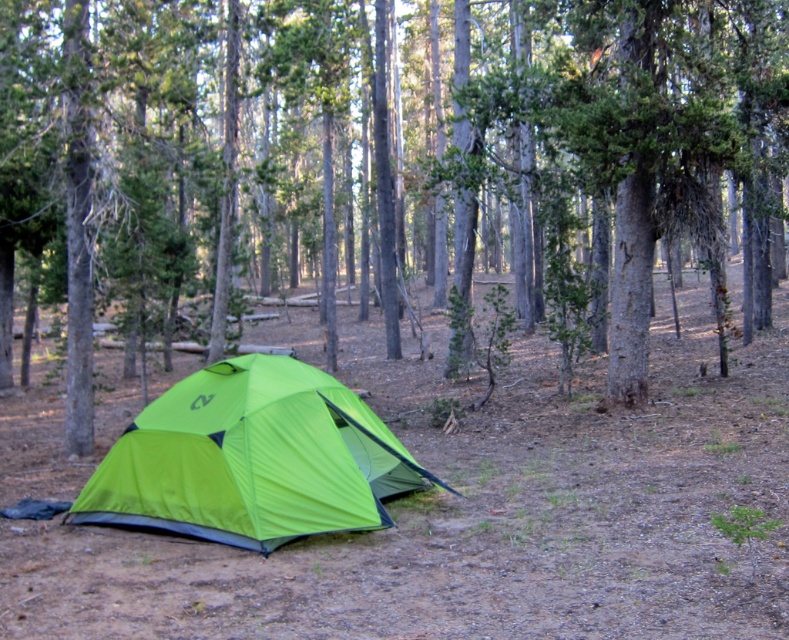
Question: Which of the following is the closest to the observer?

Choices:
 (A) (477, 100)
 (B) (343, 404)

Answer: (B)

Question: Is green fabric tent at center to the left of lime green fabric tent at center from the viewer's perspective?

Choices:
 (A) no
 (B) yes

Answer: (A)

Question: Does green fabric tent at center appear over lime green fabric tent at center?

Choices:
 (A) yes
 (B) no

Answer: (A)

Question: Does green fabric tent at center appear over lime green fabric tent at center?

Choices:
 (A) yes
 (B) no

Answer: (A)

Question: Which point appears closest to the camera in this image?

Choices:
 (A) (335, 93)
 (B) (257, 387)

Answer: (B)